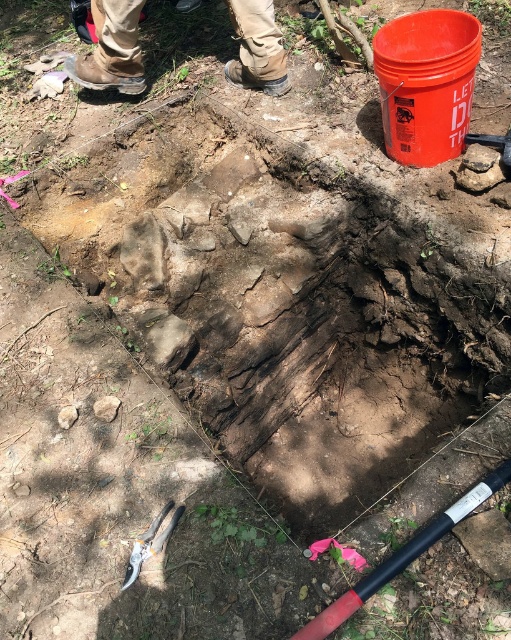
You are an archaeologist wearing boots and need to place both the brown leather boots at upper left and the metallic silver pliers at lower left into a storage box. If the box can only accommodate one of them due to size constraints, which object should you prioritize placing first?

The brown leather boots at upper left should be prioritized since its width is larger than the metallic silver pliers at lower left, making it harder to fit into the storage box later if placed second.

You are an archaeologist at the excavation site. You need to place both the brown leather boots at upper left and the metallic silver pliers at lower left into a storage box. The box has a height limit of 1 meter. Can both items fit vertically without exceeding the height limit?

The brown leather boots at upper left is taller than metallic silver pliers at lower left. However, since the box has a height limit of 1 meter, both items can fit vertically as long as their individual heights are under 1 meter. The description only states the relative height between them, not their absolute measurements.

You are an archaeologist at the excavation site. You need to place a protective cover over both the brown leather boots at upper left and the black rubber pole at lower center. Which object requires a larger cover in terms of height?

The brown leather boots at upper left requires a larger cover because it is taller than the black rubber pole at lower center.